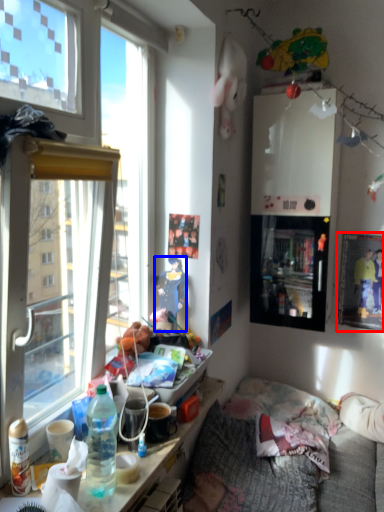
Question: Which point is further to the camera, picture frame (highlighted by a red box) or person (highlighted by a blue box)?

Choices:
 (A) picture frame
 (B) person

Answer: (A)